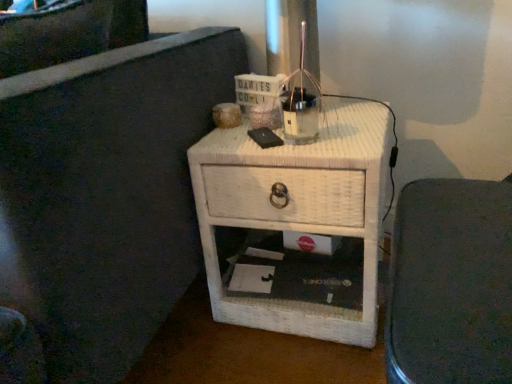
Find the location of `white wicker nightstand at center`. white wicker nightstand at center is located at coordinates (298, 210).

This screenshot has height=384, width=512. Describe the element at coordinates (298, 210) in the screenshot. I see `white wicker nightstand at center` at that location.

This screenshot has height=384, width=512. What are the coordinates of `white wicker nightstand at center` in the screenshot? It's located at (451, 284).

The image size is (512, 384). What do you see at coordinates (451, 284) in the screenshot?
I see `white wicker nightstand at center` at bounding box center [451, 284].

The width and height of the screenshot is (512, 384). Find the location of `white wicker nightstand at center`. white wicker nightstand at center is located at coordinates (298, 210).

Which object is positioned more to the left, white wicker nightstand at center or white wicker nightstand at center?

Positioned to the left is white wicker nightstand at center.

Is white wicker nightstand at center positioned behind white wicker nightstand at center?

No, the depth of white wicker nightstand at center is less than that of white wicker nightstand at center.

Is point (504, 350) closer to camera compared to point (282, 300)?

Yes, point (504, 350) is closer to viewer.

From the image's perspective, which object appears higher, white wicker nightstand at center or white wicker nightstand at center?

white wicker nightstand at center, from the image's perspective.

From a real-world perspective, who is located higher, white wicker nightstand at center or white wicker nightstand at center?

From a 3D spatial view, white wicker nightstand at center is above.

Between white wicker nightstand at center and white wicker nightstand at center, which one has smaller width?

white wicker nightstand at center.

Who is taller, white wicker nightstand at center or white wicker nightstand at center?

With more height is white wicker nightstand at center.

Considering the sizes of objects white wicker nightstand at center and white wicker nightstand at center in the image provided, who is smaller, white wicker nightstand at center or white wicker nightstand at center?

white wicker nightstand at center is smaller.

Is white wicker nightstand at center outside of white wicker nightstand at center?

white wicker nightstand at center lies outside white wicker nightstand at center's area.

Consider the image. Are white wicker nightstand at center and white wicker nightstand at center far apart?

white wicker nightstand at center is actually quite close to white wicker nightstand at center.

Is white wicker nightstand at center looking in the opposite direction of white wicker nightstand at center?

No, white wicker nightstand at center's orientation is not away from white wicker nightstand at center.

Can you tell me how much white wicker nightstand at center and white wicker nightstand at center differ in facing direction?

They differ by 90.7 degrees in their facing directions.

The width and height of the screenshot is (512, 384). I want to click on nightstand that appears below the white wicker nightstand at center (from a real-world perspective), so click(298, 210).

Which is more to the right, white wicker nightstand at center or white wicker nightstand at center?

white wicker nightstand at center.

Which object is closer to the camera taking this photo, white wicker nightstand at center or white wicker nightstand at center?

white wicker nightstand at center.

Which is nearer, (x=254, y=321) or (x=450, y=234)?

Clearly, point (x=254, y=321) is more distant from the camera than point (x=450, y=234).

From the image's perspective, is white wicker nightstand at center located above white wicker nightstand at center?

Yes, from the image's perspective, white wicker nightstand at center is above white wicker nightstand at center.

From a real-world perspective, is white wicker nightstand at center positioned over white wicker nightstand at center based on gravity?

No.

Is white wicker nightstand at center wider or thinner than white wicker nightstand at center?

white wicker nightstand at center is wider than white wicker nightstand at center.

Does white wicker nightstand at center have a lesser height compared to white wicker nightstand at center?

Yes.

Is white wicker nightstand at center smaller than white wicker nightstand at center?

No.

Is white wicker nightstand at center located within white wicker nightstand at center?

Definitely not — white wicker nightstand at center is not inside white wicker nightstand at center.

Are white wicker nightstand at center and white wicker nightstand at center beside each other?

white wicker nightstand at center and white wicker nightstand at center are not in contact.

Could you tell me if white wicker nightstand at center is facing white wicker nightstand at center?

No, white wicker nightstand at center is not facing towards white wicker nightstand at center.

How many degrees apart are the facing directions of white wicker nightstand at center and white wicker nightstand at center?

The angle between the facing direction of white wicker nightstand at center and the facing direction of white wicker nightstand at center is 90.7 degrees.

How far apart are white wicker nightstand at center and white wicker nightstand at center?

The distance of white wicker nightstand at center from white wicker nightstand at center is 14.27 inches.

Identify the location of nightstand lying on the left of white wicker nightstand at center. (298, 210).

Find the location of a particular element. furniture above the white wicker nightstand at center (from a real-world perspective) is located at coordinates (451, 284).

Find the location of `furniture that appears below the white wicker nightstand at center (from the image's perspective)`. furniture that appears below the white wicker nightstand at center (from the image's perspective) is located at coordinates (451, 284).